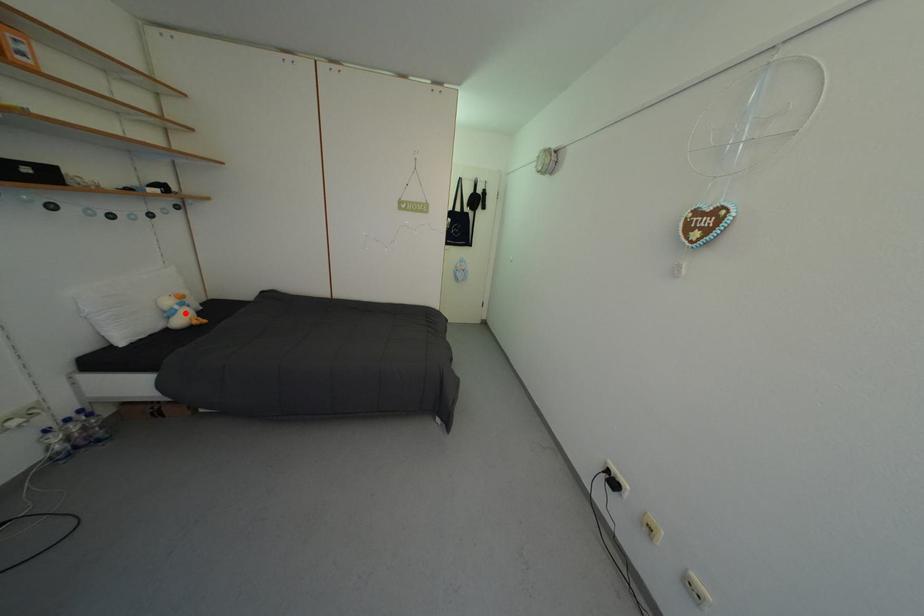
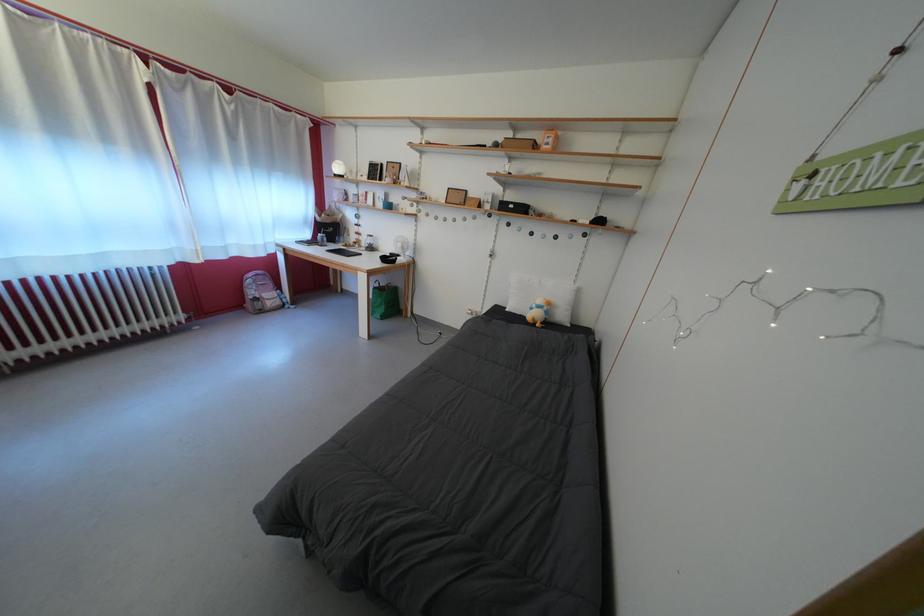
Find the pixel in the second image that matches the highlighted location in the first image.

(542, 312)